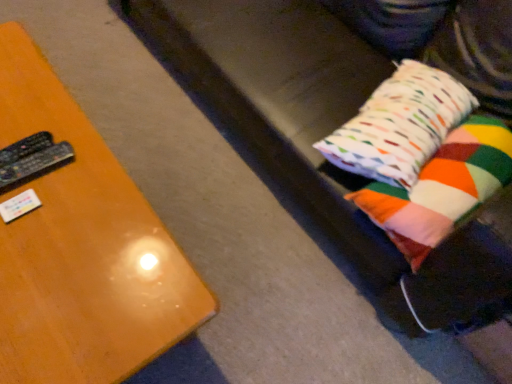
Where is `vacant space to the right of black plastic remote at left, which is the second remote in bottom-to-top order`? The image size is (512, 384). vacant space to the right of black plastic remote at left, which is the second remote in bottom-to-top order is located at coordinates (78, 183).